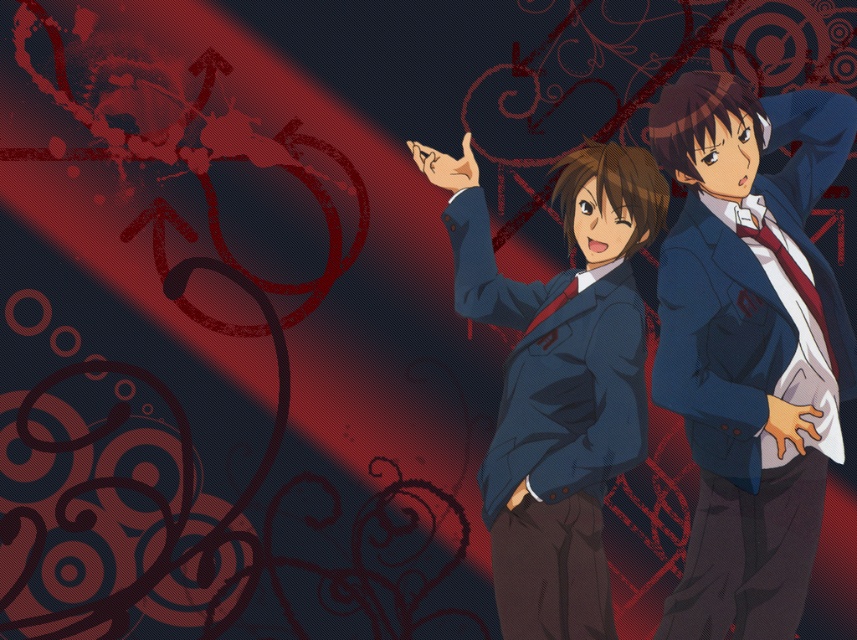
Question: Is matte blue blazer at right behind matte blue blazer at center?

Choices:
 (A) no
 (B) yes

Answer: (B)

Question: Which object is closer to the camera taking this photo?

Choices:
 (A) matte blue blazer at right
 (B) matte blue blazer at center

Answer: (B)

Question: Is matte blue blazer at right closer to the viewer compared to matte blue blazer at center?

Choices:
 (A) yes
 (B) no

Answer: (B)

Question: Which of the following is the closest to the observer?

Choices:
 (A) (712, 285)
 (B) (475, 310)

Answer: (A)

Question: Which point is farther to the camera?

Choices:
 (A) (760, 257)
 (B) (448, 163)

Answer: (B)

Question: Is matte blue blazer at right further to the viewer compared to matte blue blazer at center?

Choices:
 (A) no
 (B) yes

Answer: (B)